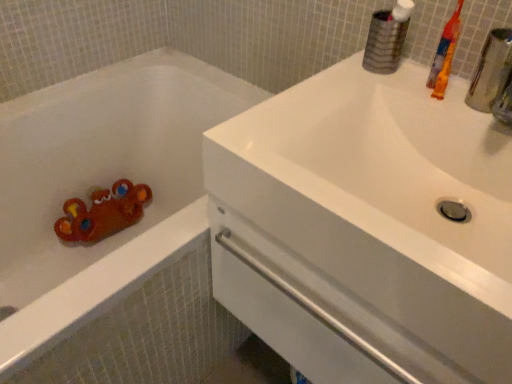
This screenshot has width=512, height=384. What do you see at coordinates (366, 229) in the screenshot?
I see `white glossy sink at upper right` at bounding box center [366, 229].

I want to click on white glossy sink at upper right, so click(366, 229).

Find the location of a particular element. matte plastic bathtub at left is located at coordinates point(118,233).

From a real-world perspective, is orange plastic toothbrush at upper right positioned over matte plastic bathtub at left based on gravity?

Correct, in the physical world, orange plastic toothbrush at upper right is higher than matte plastic bathtub at left.

Does orange plastic toothbrush at upper right have a smaller size compared to matte plastic bathtub at left?

Indeed, orange plastic toothbrush at upper right has a smaller size compared to matte plastic bathtub at left.

Considering the sizes of orange plastic toothbrush at upper right and matte plastic bathtub at left in the image, is orange plastic toothbrush at upper right taller or shorter than matte plastic bathtub at left?

orange plastic toothbrush at upper right is shorter than matte plastic bathtub at left.

Which is farther from the camera, (218, 201) or (18, 198)?

The point (18, 198) is farther from the camera.

From a real-world perspective, who is located lower, white glossy sink at upper right or matte plastic bathtub at left?

matte plastic bathtub at left, from a real-world perspective.

Which is behind, white glossy sink at upper right or matte plastic bathtub at left?

Positioned behind is matte plastic bathtub at left.

How far apart are white glossy sink at upper right and matte plastic bathtub at left?

white glossy sink at upper right is 64.91 centimeters from matte plastic bathtub at left.

Can you tell me how much orange plastic toothbrush at upper right and white glossy sink at upper right differ in facing direction?

The angle between the facing direction of orange plastic toothbrush at upper right and the facing direction of white glossy sink at upper right is 0.000439 degrees.

The width and height of the screenshot is (512, 384). What are the coordinates of `sink on the left of orange plastic toothbrush at upper right` in the screenshot? It's located at (366, 229).

Is orange plastic toothbrush at upper right to the right of white glossy sink at upper right from the viewer's perspective?

Yes.

Considering the sizes of orange plastic toothbrush at upper right and white glossy sink at upper right in the image, is orange plastic toothbrush at upper right bigger or smaller than white glossy sink at upper right?

Considering their sizes, orange plastic toothbrush at upper right takes up less space than white glossy sink at upper right.

Can you confirm if matte plastic bathtub at left is shorter than orange plastic toothbrush at upper right?

No, matte plastic bathtub at left is not shorter than orange plastic toothbrush at upper right.

Which object is further away from the camera, matte plastic bathtub at left or orange plastic toothbrush at upper right?

Positioned behind is orange plastic toothbrush at upper right.

Is matte plastic bathtub at left beside orange plastic toothbrush at upper right?

No, matte plastic bathtub at left is not in contact with orange plastic toothbrush at upper right.

Considering the sizes of objects white glossy sink at upper right and orange plastic toothbrush at upper right in the image provided, who is bigger, white glossy sink at upper right or orange plastic toothbrush at upper right?

white glossy sink at upper right is bigger.

Is point (490, 155) in front of point (436, 74)?

That is True.

From the image's perspective, which object appears higher, white glossy sink at upper right or orange plastic toothbrush at upper right?

From the image's view, orange plastic toothbrush at upper right is above.

Is matte plastic bathtub at left next to white glossy sink at upper right and touching it?

There is a gap between matte plastic bathtub at left and white glossy sink at upper right.

From a real-world perspective, is matte plastic bathtub at left positioned under white glossy sink at upper right based on gravity?

Yes, from a real-world perspective, matte plastic bathtub at left is below white glossy sink at upper right.

Does point (129, 247) appear closer or farther from the camera than point (397, 256)?

Point (129, 247).

Considering the positions of objects matte plastic bathtub at left and white glossy sink at upper right in the image provided, who is more to the left, matte plastic bathtub at left or white glossy sink at upper right?

matte plastic bathtub at left is more to the left.

You are a GUI agent. You are given a task and a screenshot of the screen. Output one action in this format:
    pyautogui.click(x=<x>, y=<y>)
    Task: Click on the bathtub below the orange plastic toothbrush at upper right (from a real-world perspective)
    The image size is (512, 384).
    Given the screenshot: What is the action you would take?
    pyautogui.click(x=118, y=233)

The image size is (512, 384). What are the coordinates of `sink located above the matte plastic bathtub at left (from a real-world perspective)` in the screenshot? It's located at (366, 229).

Estimate the real-world distances between objects in this image. Which object is closer to matte plastic bathtub at left, white glossy sink at upper right or orange plastic toothbrush at upper right?

white glossy sink at upper right is positioned closer to the anchor matte plastic bathtub at left.

Which object lies further to the anchor point matte plastic bathtub at left, orange plastic toothbrush at upper right or white glossy sink at upper right?

Based on the image, orange plastic toothbrush at upper right appears to be further to matte plastic bathtub at left.

Estimate the real-world distances between objects in this image. Which object is closer to white glossy sink at upper right, orange plastic toothbrush at upper right or matte plastic bathtub at left?

orange plastic toothbrush at upper right is closer to white glossy sink at upper right.

When comparing their distances from orange plastic toothbrush at upper right, does white glossy sink at upper right or matte plastic bathtub at left seem further?

matte plastic bathtub at left lies further to orange plastic toothbrush at upper right than the other object.

Which object lies nearer to the anchor point white glossy sink at upper right, matte plastic bathtub at left or orange plastic toothbrush at upper right?

Based on the image, orange plastic toothbrush at upper right appears to be nearer to white glossy sink at upper right.

Looking at the image, which one is located further to orange plastic toothbrush at upper right, matte plastic bathtub at left or white glossy sink at upper right?

The object further to orange plastic toothbrush at upper right is matte plastic bathtub at left.

You are a GUI agent. You are given a task and a screenshot of the screen. Output one action in this format:
    pyautogui.click(x=<x>, y=<y>)
    Task: Click on the sink between matte plastic bathtub at left and orange plastic toothbrush at upper right
    This screenshot has height=384, width=512.
    Given the screenshot: What is the action you would take?
    pyautogui.click(x=366, y=229)